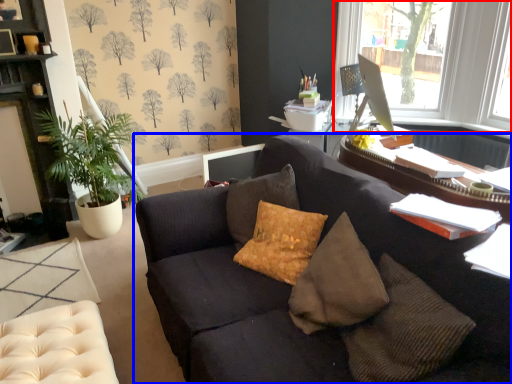
Question: Which object is closer to the camera taking this photo, window (highlighted by a red box) or studio couch (highlighted by a blue box)?

Choices:
 (A) window
 (B) studio couch

Answer: (B)